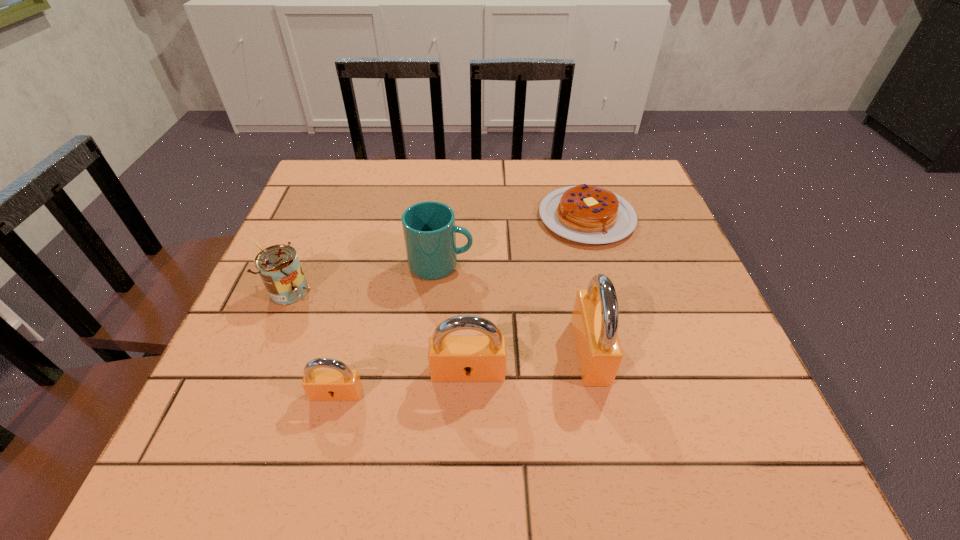
At what (x,y) coordinates should I click in order to perform the action: click on vacant space at the far left corner of the desktop. Please return your answer as a coordinate pair (x, y). The height and width of the screenshot is (540, 960). Looking at the image, I should click on (344, 188).

Locate an element on the screen. The height and width of the screenshot is (540, 960). vacant region at the near left corner of the desktop is located at coordinates (275, 393).

Find the location of a particular element. The image size is (960, 540). free space between the second padlock from right to left and the can is located at coordinates (379, 330).

This screenshot has height=540, width=960. What are the coordinates of `free point between the cup and the shortest padlock` in the screenshot? It's located at (389, 329).

Find the location of a particular element. empty space between the can and the cup is located at coordinates (366, 277).

Where is `vacant point located between the cup and the farthest object`? The image size is (960, 540). vacant point located between the cup and the farthest object is located at coordinates (514, 241).

Where is `free spot between the cup and the can`? The width and height of the screenshot is (960, 540). free spot between the cup and the can is located at coordinates (366, 277).

What are the coordinates of `unoccupied position between the second shortest object and the can` in the screenshot? It's located at (314, 342).

At what (x,y) coordinates should I click in order to perform the action: click on free space that is in between the rightmost padlock and the second tallest padlock. Please return your answer as a coordinate pair (x, y). Looking at the image, I should click on (529, 362).

The width and height of the screenshot is (960, 540). Identify the location of free space between the farthest object and the second padlock from right to left. (527, 294).